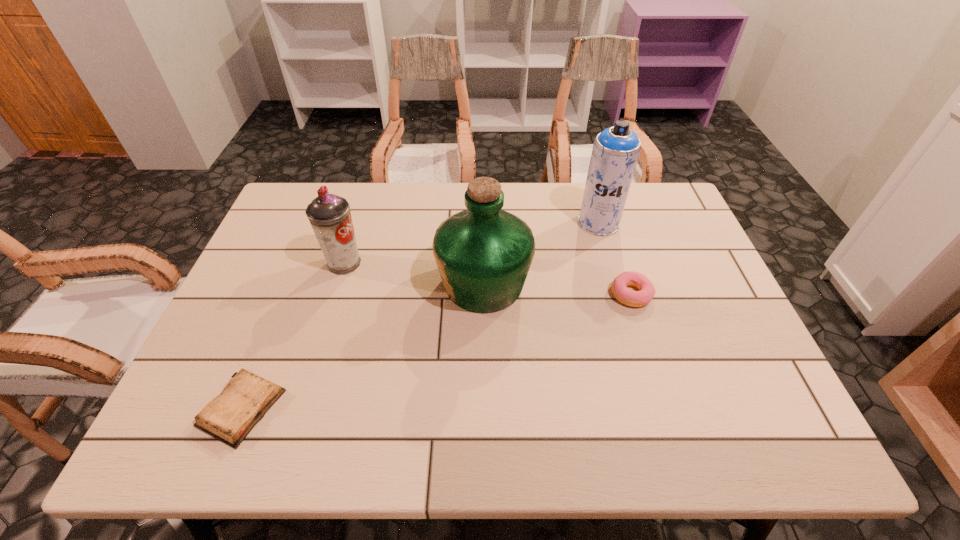
Locate an element on the screen. The width and height of the screenshot is (960, 540). the right aerosol can is located at coordinates (615, 152).

At what (x,y) coordinates should I click in order to perform the action: click on the taller aerosol can. Please return your answer as a coordinate pair (x, y). Looking at the image, I should click on (615, 152).

Find the location of a particular element. Image resolution: width=960 pixels, height=540 pixels. liquor is located at coordinates (483, 254).

Find the location of a particular element. The height and width of the screenshot is (540, 960). the shorter aerosol can is located at coordinates (329, 215).

Identify the location of the third tallest object. The height and width of the screenshot is (540, 960). (329, 215).

Identify the location of the fourth tallest object. (619, 288).

This screenshot has width=960, height=540. In order to click on the shortest object in this screenshot , I will do `click(229, 417)`.

You are a GUI agent. You are given a task and a screenshot of the screen. Output one action in this format:
    pyautogui.click(x=<x>, y=<y>)
    Task: Click on the diary
    
    Given the screenshot: What is the action you would take?
    pyautogui.click(x=229, y=417)

In order to click on free point located 0.070m on the back of the taller aerosol can in this screenshot , I will do `click(591, 197)`.

The height and width of the screenshot is (540, 960). Find the location of `vacant space located on the label side of the liquor`. vacant space located on the label side of the liquor is located at coordinates (322, 284).